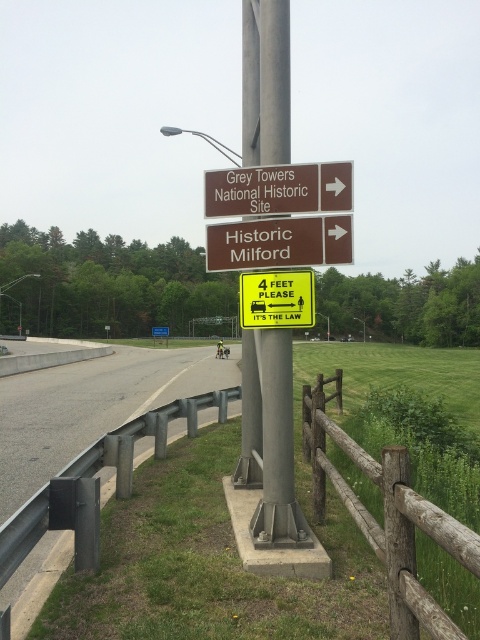
You are a photographer standing at the roadside scene with the directional signs and the yellow sign. You want to take a photo that includes both the point at coordinates point (257, 74) and point (90, 544). Which point should you focus on first to ensure both are in focus?

You should focus on point (257, 74) first because it is closer to the camera than point (90, 544), ensuring both points are within the depth of field.

You are standing at the roadside near the directional signs and want to walk to the point marked at coordinates point (83,502) and point (325,221). Which point should you head towards first if you want to reach the one closer to you first?

You should head towards point (83,502) first because it is closer to you than point (325,221).

You are a pedestrian approaching the metal guardrail at lower left and the brown wooden sign at center. Which object is taller?

The metal guardrail at lower left is taller than the brown wooden sign at center.